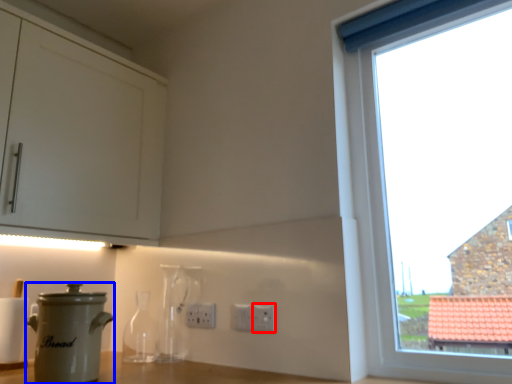
Question: Which object appears closest to the camera in this image, electric outlet (highlighted by a red box) or kitchen appliance (highlighted by a blue box)?

Choices:
 (A) electric outlet
 (B) kitchen appliance

Answer: (B)